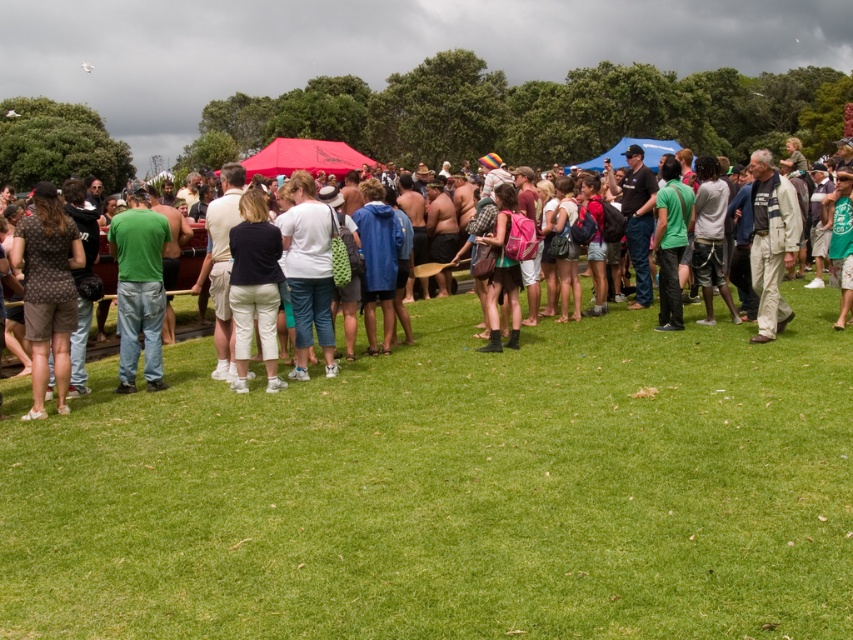
Question: Is green grass at lower center above brown dotted shirt at left?

Choices:
 (A) yes
 (B) no

Answer: (B)

Question: Which object appears closest to the camera in this image?

Choices:
 (A) green grass at lower center
 (B) brown dotted shirt at left
 (C) dark blue fabric pants at center

Answer: (A)

Question: Is brown dotted shirt at left to the left of matte green shirt at center from the viewer's perspective?

Choices:
 (A) no
 (B) yes

Answer: (B)

Question: From the image, what is the correct spatial relationship of green grass at lower center in relation to matte green shirt at center?

Choices:
 (A) right
 (B) left

Answer: (A)

Question: Which object appears closest to the camera in this image?

Choices:
 (A) matte green shirt at center
 (B) green grass at lower center
 (C) green matte shirt at center

Answer: (B)

Question: Which of these objects is positioned closest to the matte green shirt at center?

Choices:
 (A) green matte shirt at center
 (B) green grass at lower center
 (C) brown dotted shirt at left
 (D) dark blue fabric pants at center

Answer: (D)